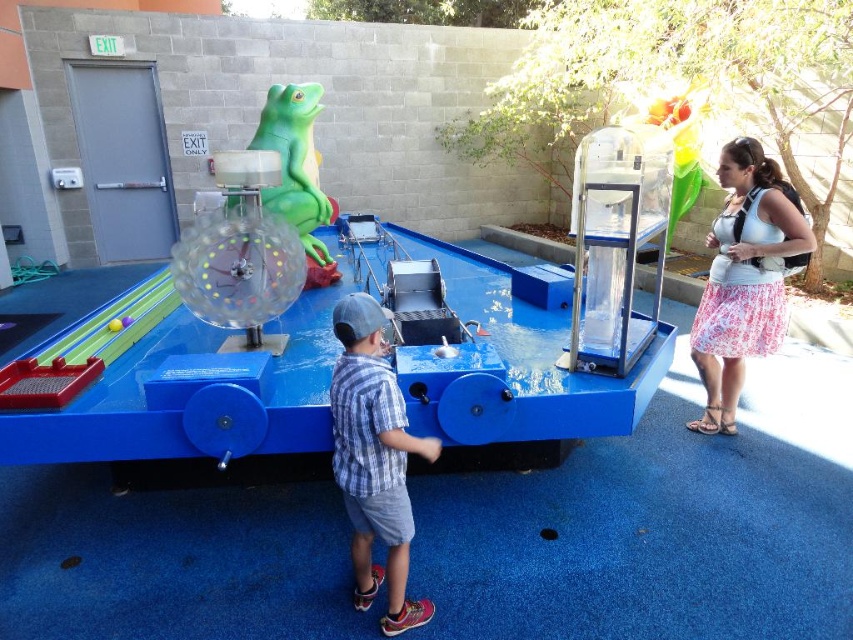
Measure the distance from floral skirt at right to plaid shirt at center.

The distance of floral skirt at right from plaid shirt at center is 2.27 meters.

Which is more to the right, floral skirt at right or plaid shirt at center?

floral skirt at right is more to the right.

Describe the element at coordinates (746, 276) in the screenshot. The image size is (853, 640). I see `floral skirt at right` at that location.

Where is `floral skirt at right`? floral skirt at right is located at coordinates (746, 276).

Can you confirm if floral skirt at right is thinner than transparent plastic ball at center?

No, floral skirt at right is not thinner than transparent plastic ball at center.

Is floral skirt at right above transparent plastic ball at center?

Correct, floral skirt at right is located above transparent plastic ball at center.

This screenshot has width=853, height=640. What do you see at coordinates (746, 276) in the screenshot?
I see `floral skirt at right` at bounding box center [746, 276].

The width and height of the screenshot is (853, 640). I want to click on floral skirt at right, so click(746, 276).

Between point (180, 410) and point (753, 310), which one is positioned in front?

Positioned in front is point (180, 410).

Consider the image. Can you confirm if translucent plastic ball at center is positioned to the left of floral skirt at right?

Yes, translucent plastic ball at center is to the left of floral skirt at right.

Is point (654, 292) more distant than point (735, 141)?

Yes, it is behind point (735, 141).

At what (x,y) coordinates should I click in order to perform the action: click on translucent plastic ball at center. Please return your answer as a coordinate pair (x, y). The image size is (853, 640). Looking at the image, I should click on (393, 362).